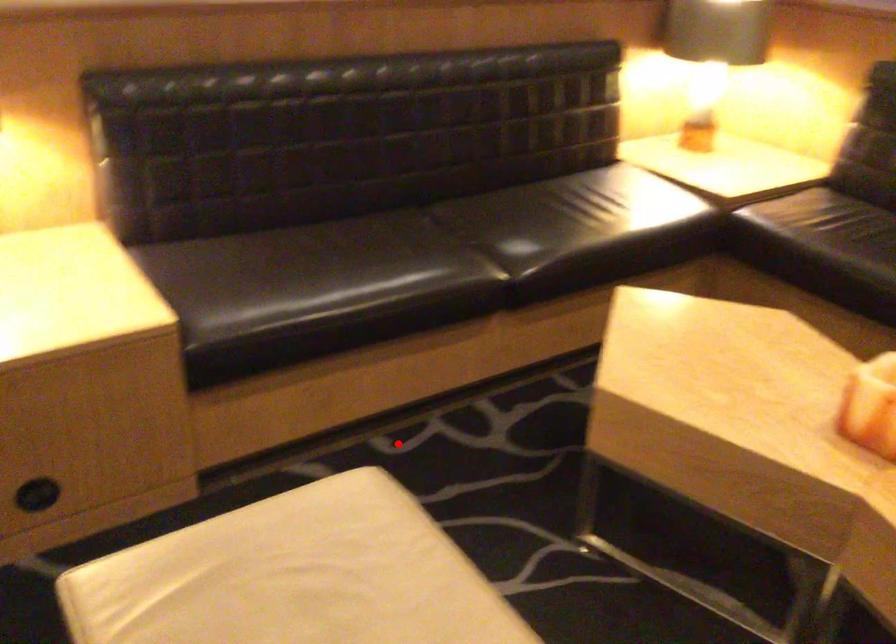
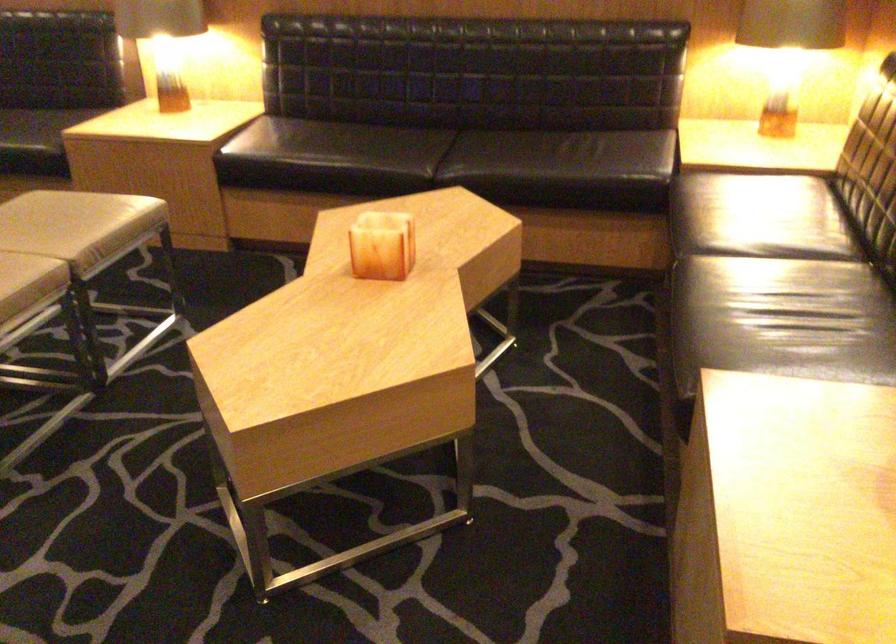
Question: A red point is marked in image1. In image2, is the corresponding 3D point closer to the camera or farther? Reply with the corresponding letter.

Choices:
 (A) The corresponding 3D point is closer.
 (B) The corresponding 3D point is farther.

Answer: (B)